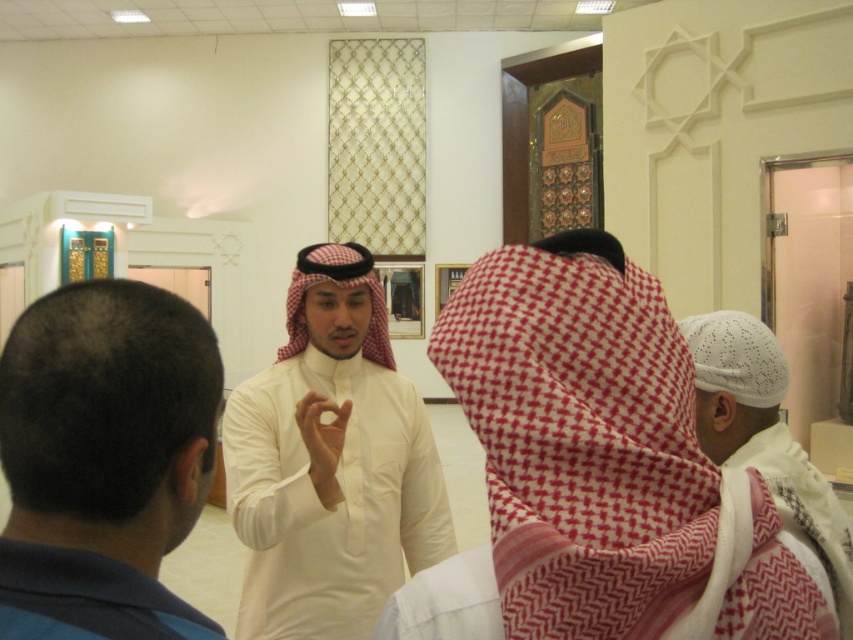
Question: Which point is closer to the camera?

Choices:
 (A) (547, 273)
 (B) (741, 340)
 (C) (410, 504)
 (D) (136, 593)

Answer: (D)

Question: Can you confirm if white cotton kufi at center is positioned to the left of blue fabric robe at lower left?

Choices:
 (A) no
 (B) yes

Answer: (A)

Question: Which point appears closest to the camera in this image?

Choices:
 (A) (16, 630)
 (B) (294, 564)
 (C) (584, 602)

Answer: (A)

Question: Is white cotton kufi at center closer to camera compared to dark blue hair at back?

Choices:
 (A) no
 (B) yes

Answer: (A)

Question: Does white cotton kufi at center come behind dark blue hair at back?

Choices:
 (A) no
 (B) yes

Answer: (B)

Question: Which of these objects is positioned farthest from the white knitted cap at center?

Choices:
 (A) blue fabric robe at lower left
 (B) white cotton kufi at center
 (C) dark blue hair at back

Answer: (A)